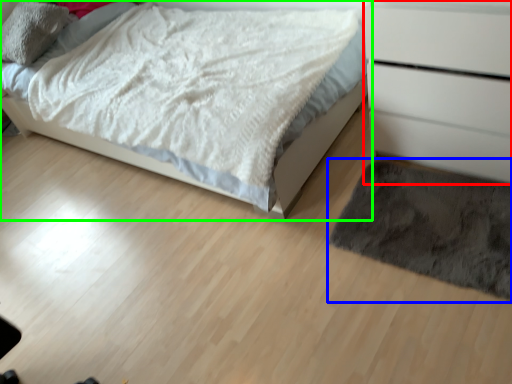
Question: Based on their relative distances, which object is nearer to chest of drawers (highlighted by a red box)? Choose from mat (highlighted by a blue box) and bed (highlighted by a green box).

Choices:
 (A) mat
 (B) bed

Answer: (A)